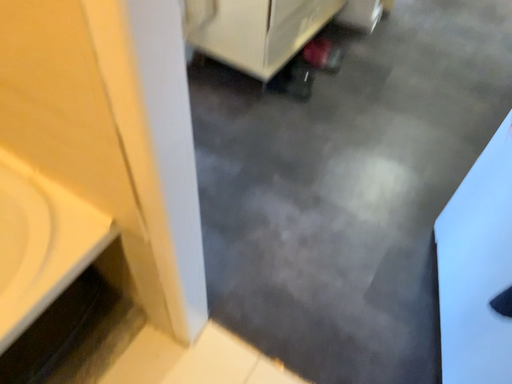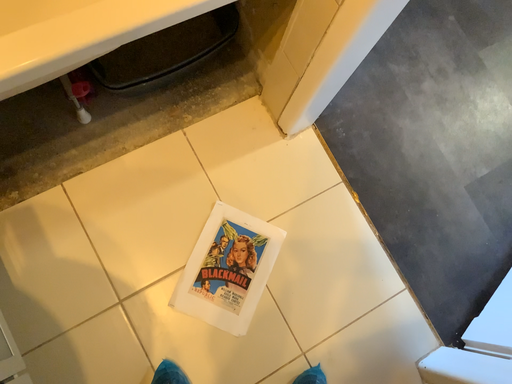
Question: Which way did the camera rotate in the video?

Choices:
 (A) rotated left
 (B) rotated right

Answer: (A)